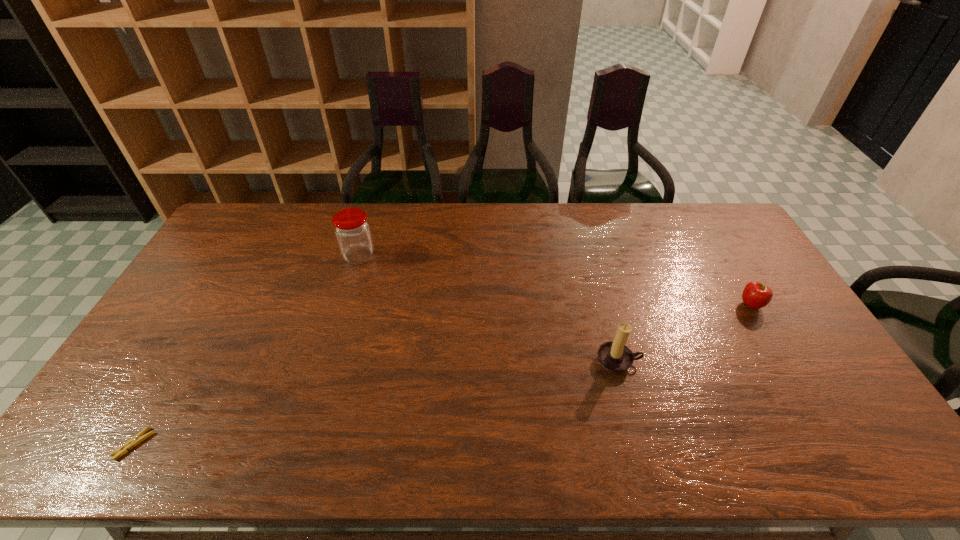
In order to click on jar in this screenshot , I will do `click(352, 230)`.

Locate an element on the screen. Image resolution: width=960 pixels, height=540 pixels. the second object from left to right is located at coordinates (x=352, y=230).

Find the location of a particular element. This screenshot has width=960, height=540. the second nearest object is located at coordinates (614, 356).

At what (x,y) coordinates should I click in order to perform the action: click on candle holder. Please return your answer as a coordinate pair (x, y). Looking at the image, I should click on (614, 356).

You are a GUI agent. You are given a task and a screenshot of the screen. Output one action in this format:
    pyautogui.click(x=<x>, y=<y>)
    Task: Click on the rightmost object
    The height and width of the screenshot is (540, 960).
    Given the screenshot: What is the action you would take?
    pyautogui.click(x=755, y=295)

Locate an element on the screen. apple is located at coordinates coord(755,295).

Identify the location of the shortest object. (138, 438).

Locate an element on the screen. The height and width of the screenshot is (540, 960). the leftmost object is located at coordinates (138, 438).

Where is `free space located on the left of the third object from right to left`? free space located on the left of the third object from right to left is located at coordinates (248, 256).

This screenshot has width=960, height=540. What are the coordinates of `vacant region located 0.060m on the wick of the candle holder` in the screenshot? It's located at (628, 396).